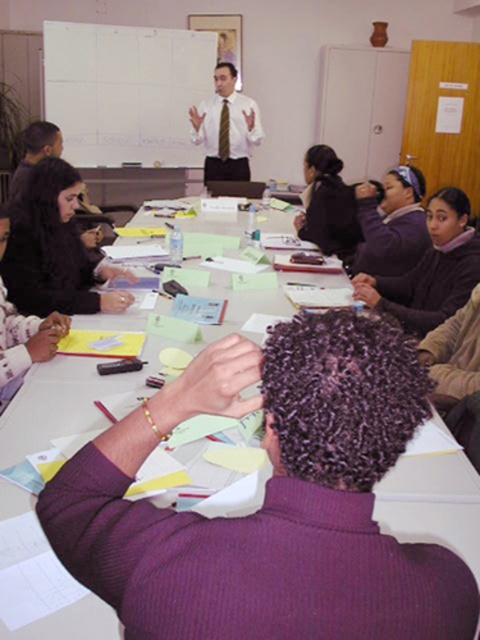
Question: Estimate the real-world distances between objects in this image. Which object is farther from the white shirt with tie at upper center?

Choices:
 (A) matte black sweater at lower left
 (B) dark purple sweater at upper right
 (C) white paper at center

Answer: (C)

Question: Is white paper at center bigger than white shirt with tie at upper center?

Choices:
 (A) no
 (B) yes

Answer: (B)

Question: Considering the relative positions of matte black sweater at lower left and purple fleece jacket at upper center in the image provided, where is matte black sweater at lower left located with respect to purple fleece jacket at upper center?

Choices:
 (A) left
 (B) right

Answer: (A)

Question: Which point is farther from the camera taking this photo?

Choices:
 (A) (68, 173)
 (B) (216, 125)

Answer: (B)

Question: Does purple fleece jacket at upper center have a larger size compared to white shirt with tie at upper center?

Choices:
 (A) no
 (B) yes

Answer: (A)

Question: Which object is the closest to the white paper at center?

Choices:
 (A) dark purple sweater at upper right
 (B) purple fleece jacket at upper center

Answer: (A)